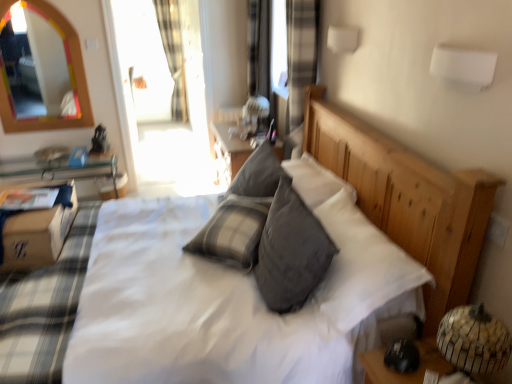
The height and width of the screenshot is (384, 512). What do you see at coordinates (44, 308) in the screenshot?
I see `white cotton bedspread at left` at bounding box center [44, 308].

At what (x,y) coordinates should I click in order to perform the action: click on rainbow-colored wooden mirror at upper left. Please return your answer as a coordinate pair (x, y). The height and width of the screenshot is (384, 512). Looking at the image, I should click on (72, 79).

What are the coordinates of `white cotton bedspread at left` in the screenshot? It's located at (44, 308).

Between rainbow-colored wooden mirror at upper left and matte white table lamp at center, which one appears on the right side from the viewer's perspective?

matte white table lamp at center.

What's the angular difference between rainbow-colored wooden mirror at upper left and matte white table lamp at center's facing directions?

rainbow-colored wooden mirror at upper left and matte white table lamp at center are facing 86.4 degrees away from each other.

Considering the positions of points (85, 111) and (249, 134), is point (85, 111) farther from camera compared to point (249, 134)?

Yes.

Is matte white table lamp at center a part of rainbow-colored wooden mirror at upper left?

No, rainbow-colored wooden mirror at upper left does not contain matte white table lamp at center.

Would you say brown cardboard box at lower left is inside or outside gray soft pillow at center?

brown cardboard box at lower left exists outside the volume of gray soft pillow at center.

From the image's perspective, is brown cardboard box at lower left located above or below gray soft pillow at center?

Based on their image positions, brown cardboard box at lower left is located above gray soft pillow at center.

In the image, is brown cardboard box at lower left positioned in front of or behind gray soft pillow at center?

In the image, brown cardboard box at lower left appears behind gray soft pillow at center.

Can you see rainbow-colored wooden mirror at upper left touching white cotton bedspread at left?

No, rainbow-colored wooden mirror at upper left is not beside white cotton bedspread at left.

Which of these two, rainbow-colored wooden mirror at upper left or white cotton bedspread at left, is smaller?

With smaller size is rainbow-colored wooden mirror at upper left.

Could you tell me if rainbow-colored wooden mirror at upper left is turned towards white cotton bedspread at left?

Yes, rainbow-colored wooden mirror at upper left is turned towards white cotton bedspread at left.

Considering the sizes of transparent glass door at upper center and plaid fabric curtain at upper left in the image, is transparent glass door at upper center taller or shorter than plaid fabric curtain at upper left?

Considering their sizes, transparent glass door at upper center has more height than plaid fabric curtain at upper left.

From the image's perspective, which is above, transparent glass door at upper center or plaid fabric curtain at upper left?

plaid fabric curtain at upper left.

Considering the relative positions of transparent glass door at upper center and plaid fabric curtain at upper left in the image provided, is transparent glass door at upper center to the right of plaid fabric curtain at upper left from the viewer's perspective?

Correct, you'll find transparent glass door at upper center to the right of plaid fabric curtain at upper left.

Considering the positions of points (176, 66) and (320, 260), is point (176, 66) farther from camera compared to point (320, 260)?

That is True.

Image resolution: width=512 pixels, height=384 pixels. Find the location of `curtain on the left of gray soft pillow at center`. curtain on the left of gray soft pillow at center is located at coordinates (173, 54).

From a real-world perspective, is plaid fabric curtain at upper left located higher than gray soft pillow at center?

Yes, from a real-world perspective, plaid fabric curtain at upper left is on top of gray soft pillow at center.

Can you confirm if plaid fabric curtain at upper left is taller than gray soft pillow at center?

Indeed, plaid fabric curtain at upper left has a greater height compared to gray soft pillow at center.

From the image's perspective, is brown cardboard box at lower left located above or below plaid fabric curtain at upper left?

From the image's perspective, brown cardboard box at lower left appears below plaid fabric curtain at upper left.

Is brown cardboard box at lower left directly adjacent to plaid fabric curtain at upper left?

No, brown cardboard box at lower left is not in contact with plaid fabric curtain at upper left.

Is brown cardboard box at lower left taller or shorter than plaid fabric curtain at upper left?

Considering their sizes, brown cardboard box at lower left has less height than plaid fabric curtain at upper left.

The image size is (512, 384). I want to click on mirror above the gray soft pillow at center (from a real-world perspective), so click(72, 79).

From a real-world perspective, is gray soft pillow at center beneath rainbow-colored wooden mirror at upper left?

Yes.

Could you tell me if gray soft pillow at center is turned towards rainbow-colored wooden mirror at upper left?

No.

How different are the orientations of gray soft pillow at center and rainbow-colored wooden mirror at upper left in degrees?

They differ by 95.4 degrees in their facing directions.

Find the location of a particular element. The width and height of the screenshot is (512, 384). table lamp that appears below the rainbow-colored wooden mirror at upper left (from a real-world perspective) is located at coordinates [253, 116].

At what (x,y) coordinates should I click in order to perform the action: click on table above the gray soft pillow at center (from the image's perspective). Please return your answer as a coordinate pair (x, y). This screenshot has width=512, height=384. Looking at the image, I should click on (38, 231).

Considering their positions, is transparent glass door at upper center positioned closer to brown cardboard box at lower left than rainbow-colored wooden mirror at upper left?

Based on the image, rainbow-colored wooden mirror at upper left appears to be nearer to brown cardboard box at lower left.

Which object lies further to the anchor point transparent glass door at upper center, brown cardboard box at lower left or matte white table lamp at center?

brown cardboard box at lower left is positioned further to the anchor transparent glass door at upper center.

From the picture: Which object lies nearer to the anchor point transparent glass door at upper center, brown cardboard box at lower left or rainbow-colored wooden mirror at upper left?

The object closer to transparent glass door at upper center is rainbow-colored wooden mirror at upper left.

From the image, which object appears to be farther from gray soft pillow at center, transparent glass door at upper center or brown cardboard box at lower left?

transparent glass door at upper center is further to gray soft pillow at center.

Which object lies nearer to the anchor point white cotton bedspread at left, matte white table lamp at center or transparent glass door at upper center?

Among the two, matte white table lamp at center is located nearer to white cotton bedspread at left.

Estimate the real-world distances between objects in this image. Which object is closer to gray soft pillow at center, transparent glass door at upper center or rainbow-colored wooden mirror at upper left?

transparent glass door at upper center lies closer to gray soft pillow at center than the other object.

When comparing their distances from plaid fabric curtain at upper left, does white cotton bedspread at left or transparent glass door at upper center seem closer?

transparent glass door at upper center lies closer to plaid fabric curtain at upper left than the other object.

When comparing their distances from plaid fabric curtain at upper left, does rainbow-colored wooden mirror at upper left or white cotton bedspread at left seem closer?

rainbow-colored wooden mirror at upper left is closer to plaid fabric curtain at upper left.

You are a GUI agent. You are given a task and a screenshot of the screen. Output one action in this format:
    pyautogui.click(x=<x>, y=<y>)
    Task: Click on the mirror positioned between gray soft pillow at center and transparent glass door at upper center from near to far
    This screenshot has width=512, height=384.
    Given the screenshot: What is the action you would take?
    pyautogui.click(x=72, y=79)

This screenshot has width=512, height=384. Find the location of `table situated between rainbow-colored wooden mirror at upper left and gray soft pillow at center from left to right`. table situated between rainbow-colored wooden mirror at upper left and gray soft pillow at center from left to right is located at coordinates (38, 231).

You are a GUI agent. You are given a task and a screenshot of the screen. Output one action in this format:
    pyautogui.click(x=<x>, y=<y>)
    Task: Click on the table lamp between gray soft pillow at center and transparent glass door at upper center along the z-axis
    The height and width of the screenshot is (384, 512).
    Given the screenshot: What is the action you would take?
    pyautogui.click(x=253, y=116)

Locate an element on the screen. This screenshot has width=512, height=384. table positioned between white cotton bedspread at left and transparent glass door at upper center from near to far is located at coordinates [x=38, y=231].